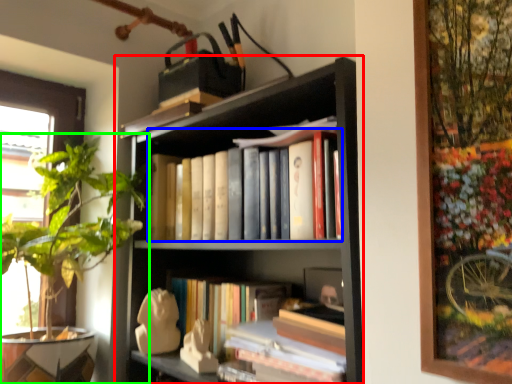
Question: Which is farther away from bookcase (highlighted by a red box)? book (highlighted by a blue box) or houseplant (highlighted by a green box)?

Choices:
 (A) book
 (B) houseplant

Answer: (B)